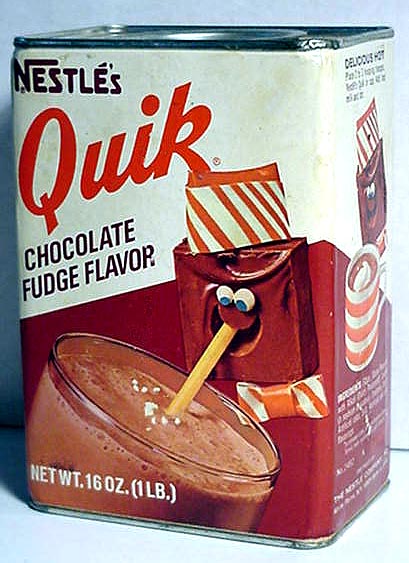
Find the location of a particular element. glass is located at coordinates (103, 418).